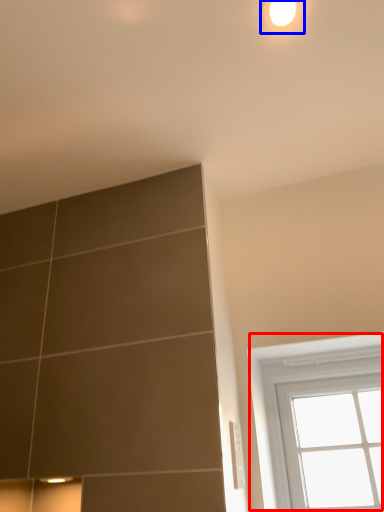
Question: Which of the following is the farthest to the observer, window (highlighted by a red box) or light (highlighted by a blue box)?

Choices:
 (A) window
 (B) light

Answer: (A)